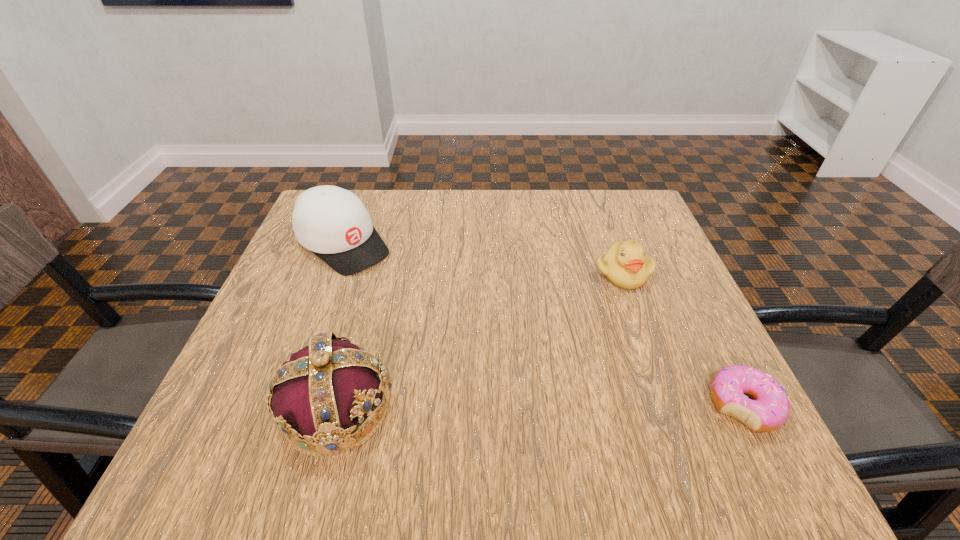
Locate an element on the screen. Image resolution: width=960 pixels, height=540 pixels. free spot between the baseball cap and the shortest object is located at coordinates (543, 325).

Identify the location of vacant space that is in between the doughnut and the crown. (540, 407).

Find the location of a particular element. free point between the baseball cap and the shortest object is located at coordinates (543, 325).

The image size is (960, 540). I want to click on free space that is in between the third tallest object and the shortest object, so pyautogui.click(x=683, y=340).

Where is `vacant area that lies between the baseball cap and the third tallest object`? The image size is (960, 540). vacant area that lies between the baseball cap and the third tallest object is located at coordinates (483, 259).

The width and height of the screenshot is (960, 540). What are the coordinates of `free space between the duckling and the baseball cap` in the screenshot? It's located at (483, 259).

Locate an element on the screen. free area in between the duckling and the crown is located at coordinates (479, 341).

Locate an element on the screen. vacant area that lies between the crown and the doughnut is located at coordinates (540, 407).

Find the location of `empty location between the baseball cap and the shortest object`. empty location between the baseball cap and the shortest object is located at coordinates (543, 325).

Choose which object is the third nearest neighbor to the shortest object. Please provide its 2D coordinates. Your answer should be formatted as a tuple, i.e. [(x, y)], where the tuple contains the x and y coordinates of a point satisfying the conditions above.

[(333, 223)]